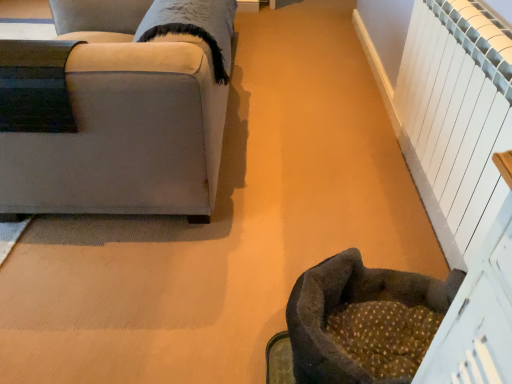
Locate an element on the screen. white fabric couch at left is located at coordinates (118, 120).

What do you see at coordinates (118, 120) in the screenshot?
I see `white fabric couch at left` at bounding box center [118, 120].

Where is `white fabric couch at left`? Image resolution: width=512 pixels, height=384 pixels. white fabric couch at left is located at coordinates (118, 120).